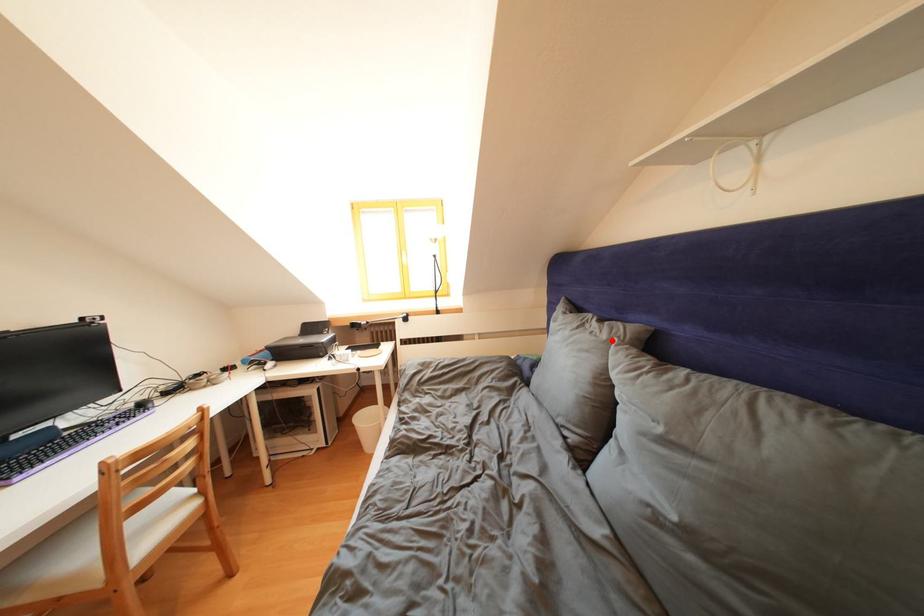
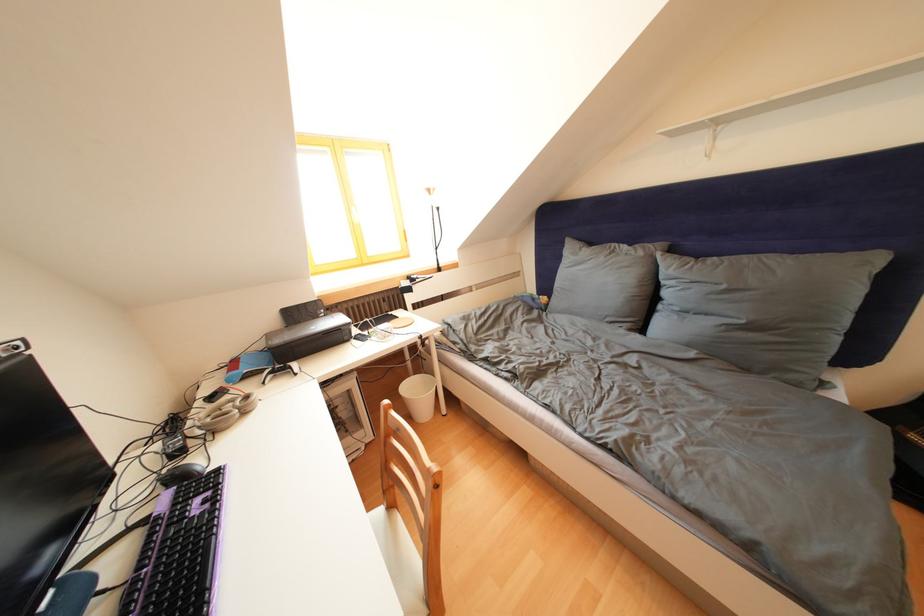
Locate, in the second image, the point that corresponds to the highlighted location in the first image.

(649, 259)